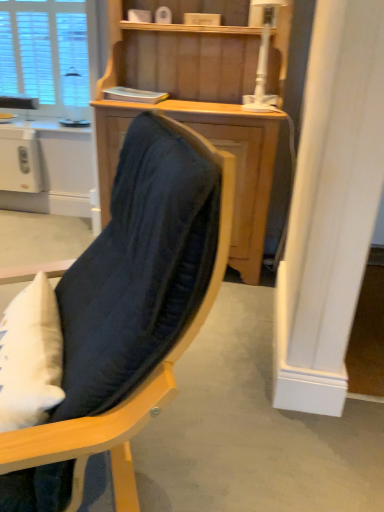
Question: Can you confirm if wooden cabinet at center is positioned to the right of white plastic toaster at left?

Choices:
 (A) no
 (B) yes

Answer: (B)

Question: Is wooden cabinet at center positioned with its back to white plastic toaster at left?

Choices:
 (A) no
 (B) yes

Answer: (A)

Question: Is wooden cabinet at center positioned before white plastic toaster at left?

Choices:
 (A) yes
 (B) no

Answer: (A)

Question: Does wooden cabinet at center have a lesser width compared to white plastic toaster at left?

Choices:
 (A) no
 (B) yes

Answer: (A)

Question: Is wooden cabinet at center shorter than white plastic toaster at left?

Choices:
 (A) no
 (B) yes

Answer: (A)

Question: Is wooden cabinet at center smaller than white plastic toaster at left?

Choices:
 (A) no
 (B) yes

Answer: (A)

Question: Is white textured window at upper left thinner than white plastic lamp at upper center?

Choices:
 (A) yes
 (B) no

Answer: (A)

Question: Considering the relative sizes of white textured window at upper left and white plastic lamp at upper center in the image provided, is white textured window at upper left smaller than white plastic lamp at upper center?

Choices:
 (A) yes
 (B) no

Answer: (B)

Question: Could white plastic lamp at upper center be considered to be inside white textured window at upper left?

Choices:
 (A) no
 (B) yes

Answer: (A)

Question: From a real-world perspective, does white textured window at upper left sit lower than white plastic lamp at upper center?

Choices:
 (A) no
 (B) yes

Answer: (B)

Question: Can you confirm if white textured window at upper left is wider than white plastic lamp at upper center?

Choices:
 (A) no
 (B) yes

Answer: (A)

Question: From the image's perspective, is white textured window at upper left on top of white plastic lamp at upper center?

Choices:
 (A) no
 (B) yes

Answer: (B)

Question: Considering the relative sizes of velvet dark blue chair at center and wooden cabinet at center in the image provided, is velvet dark blue chair at center wider than wooden cabinet at center?

Choices:
 (A) no
 (B) yes

Answer: (B)